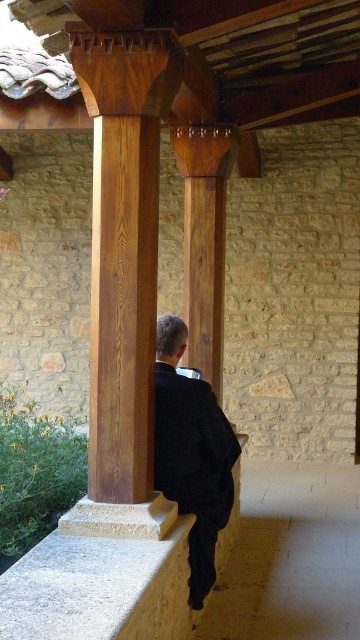
You are an architect designing a new outdoor seating area. You want to place a bench that is 2 meters wide. The bench must be placed on either the smooth polished wood column at center or the smooth concrete ledge at lower center. Which surface can accommodate the bench based on their widths?

The smooth polished wood column at center has a lesser width compared to smooth concrete ledge at lower center. Therefore, the smooth concrete ledge at lower center can accommodate the 2 meter wide bench since it is wider than the column.

You are standing at point (135,540) and want to walk towards point (128,300). Based on the scene description, will you be moving forward or backward?

Since point (128,300) is behind point (135,540), moving towards it would mean you are moving backward.